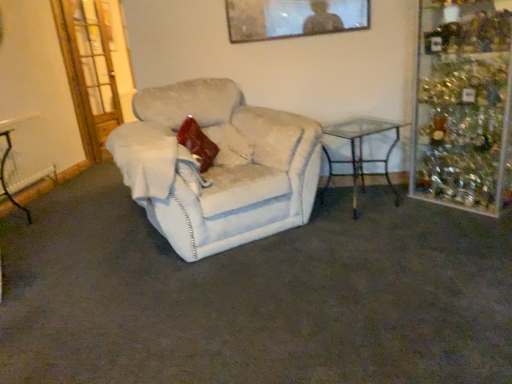
This screenshot has height=384, width=512. Describe the element at coordinates (4, 173) in the screenshot. I see `metallic wire table at left, the first table viewed from the left` at that location.

What is the approximate width of glass reflective shelf at right?

53.91 centimeters.

Describe the element at coordinates (89, 72) in the screenshot. I see `wooden glass door at left` at that location.

Locate an element on the screen. metallic wire table at left, which is the second table from right to left is located at coordinates (4, 173).

What's the angular difference between metallic wire table at left, the first table viewed from the left, and wooden glass door at left's facing directions?

metallic wire table at left, the first table viewed from the left, and wooden glass door at left are facing 17.4 degrees away from each other.

Is metallic wire table at left, which is the second table from right to left, positioned with its back to wooden glass door at left?

No, wooden glass door at left is not at the back of metallic wire table at left, which is the second table from right to left.

Considering the relative positions of metallic wire table at left, which is the second table from right to left, and wooden glass door at left in the image provided, is metallic wire table at left, which is the second table from right to left, to the left of wooden glass door at left from the viewer's perspective?

Yes, metallic wire table at left, which is the second table from right to left, is to the left of wooden glass door at left.

How different are the orientations of velvet red pillow at center and clear glass table at right, the second table positioned from the left, in degrees?

60 degrees separate the facing orientations of velvet red pillow at center and clear glass table at right, the second table positioned from the left.

You are a GUI agent. You are given a task and a screenshot of the screen. Output one action in this format:
    pyautogui.click(x=<x>, y=<y>)
    Task: Click on the pillow on the left of clear glass table at right, the second table positioned from the left
    
    Given the screenshot: What is the action you would take?
    pyautogui.click(x=197, y=143)

Is velvet red pillow at center aimed at clear glass table at right, the 1th table viewed from the right?

Yes, velvet red pillow at center faces towards clear glass table at right, the 1th table viewed from the right.

From a real-world perspective, who is located higher, velvet red pillow at center or clear glass table at right, the 1th table viewed from the right?

velvet red pillow at center, from a real-world perspective.

Which object is further away from the camera, wooden glass door at left or velvet red pillow at center?

wooden glass door at left is further from the camera.

Does wooden glass door at left contain velvet red pillow at center?

No, velvet red pillow at center is not surrounded by wooden glass door at left.

Consider the image. Are wooden glass door at left and velvet red pillow at center beside each other?

No, wooden glass door at left is not touching velvet red pillow at center.

From a real-world perspective, is wooden glass door at left on top of velvet red pillow at center?

Yes, from a real-world perspective, wooden glass door at left is on top of velvet red pillow at center.

What's the angular difference between clear glass table at right, the 1th table viewed from the right, and glass reflective shelf at right's facing directions?

The facing directions of clear glass table at right, the 1th table viewed from the right, and glass reflective shelf at right are 69.5 degrees apart.

Can glass reflective shelf at right be found inside clear glass table at right, the second table positioned from the left?

No.

How distant is clear glass table at right, the second table positioned from the left, from glass reflective shelf at right?

clear glass table at right, the second table positioned from the left, is 20.99 inches away from glass reflective shelf at right.

From a real-world perspective, is clear glass table at right, the 1th table viewed from the right, below glass reflective shelf at right?

Indeed, from a real-world perspective, clear glass table at right, the 1th table viewed from the right, is positioned beneath glass reflective shelf at right.

Which is more distant, (430, 46) or (226, 128)?

The point (226, 128) is farther from the camera.

Is glass reflective shelf at right completely or partially outside of white fabric chair at center?

Yes, glass reflective shelf at right is outside of white fabric chair at center.

Can you confirm if glass reflective shelf at right is thinner than white fabric chair at center?

Yes, glass reflective shelf at right is thinner than white fabric chair at center.

Is glass reflective shelf at right in front of or behind white fabric chair at center in the image?

glass reflective shelf at right is behind white fabric chair at center.

Considering the relative positions of wooden glass door at left and metallic wire table at left, the first table viewed from the left, in the image provided, is wooden glass door at left to the left or to the right of metallic wire table at left, the first table viewed from the left,?

In the image, wooden glass door at left appears on the right side of metallic wire table at left, the first table viewed from the left.

Is wooden glass door at left far away from metallic wire table at left, which is the second table from right to left?

That's right, there is a large distance between wooden glass door at left and metallic wire table at left, which is the second table from right to left.

Identify the location of the 2nd table positioned below the wooden glass door at left (from the image's perspective). (4, 173).

Between wooden glass door at left and metallic wire table at left, the first table viewed from the left, which one has smaller width?

With smaller width is wooden glass door at left.

The image size is (512, 384). Identify the location of shelf on the right of velvet red pillow at center. (463, 106).

How much distance is there between velvet red pillow at center and glass reflective shelf at right?

A distance of 1.69 meters exists between velvet red pillow at center and glass reflective shelf at right.

From the picture: Does velvet red pillow at center come behind glass reflective shelf at right?

That is True.

Is velvet red pillow at center inside the boundaries of glass reflective shelf at right, or outside?

velvet red pillow at center lies outside glass reflective shelf at right.

Find the location of `table lying on the left of wooden glass door at left`. table lying on the left of wooden glass door at left is located at coordinates (4, 173).

In order to click on pillow above the clear glass table at right, the 1th table viewed from the right (from a real-world perspective) in this screenshot , I will do `click(197, 143)`.

From the image, which object appears to be farther from velvet red pillow at center, wooden glass door at left or glass reflective shelf at right?

The object further to velvet red pillow at center is wooden glass door at left.

Estimate the real-world distances between objects in this image. Which object is further from metallic silver picture frame at upper center, white fabric chair at center or velvet red pillow at center?

velvet red pillow at center is positioned further to the anchor metallic silver picture frame at upper center.

Looking at the image, which one is located further to velvet red pillow at center, metallic wire table at left, which is the second table from right to left, or white fabric chair at center?

The object further to velvet red pillow at center is metallic wire table at left, which is the second table from right to left.

Looking at the image, which one is located further to metallic wire table at left, which is the second table from right to left, metallic silver picture frame at upper center or clear glass table at right, the second table positioned from the left?

The object further to metallic wire table at left, which is the second table from right to left, is clear glass table at right, the second table positioned from the left.

Which object lies further to the anchor point wooden glass door at left, white fabric chair at center or clear glass table at right, the second table positioned from the left?

clear glass table at right, the second table positioned from the left.

Which object lies nearer to the anchor point white fabric chair at center, clear glass table at right, the 1th table viewed from the right, or velvet red pillow at center?

velvet red pillow at center is positioned closer to the anchor white fabric chair at center.

When comparing their distances from metallic silver picture frame at upper center, does velvet red pillow at center or wooden glass door at left seem further?

Based on the image, wooden glass door at left appears to be further to metallic silver picture frame at upper center.

Looking at the image, which one is located closer to glass reflective shelf at right, velvet red pillow at center or metallic wire table at left, which is the second table from right to left?

velvet red pillow at center.

Image resolution: width=512 pixels, height=384 pixels. What are the coordinates of `picture frame between wooden glass door at left and glass reflective shelf at right` in the screenshot? It's located at click(293, 18).

At what (x,y) coordinates should I click in order to perform the action: click on table between wooden glass door at left and glass reflective shelf at right from left to right. Please return your answer as a coordinate pair (x, y). Looking at the image, I should click on (361, 152).

This screenshot has width=512, height=384. Identify the location of pillow between metallic wire table at left, the first table viewed from the left, and clear glass table at right, the 1th table viewed from the right. (197, 143).

The height and width of the screenshot is (384, 512). I want to click on pillow between metallic wire table at left, the first table viewed from the left, and metallic silver picture frame at upper center, in the horizontal direction, so click(197, 143).